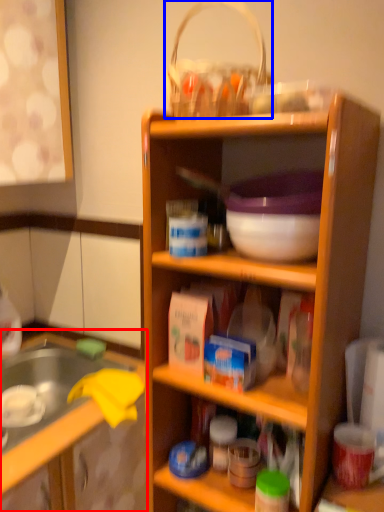
Question: Which of the following is the closest to the observer, cabinetry (highlighted by a red box) or basket (highlighted by a blue box)?

Choices:
 (A) cabinetry
 (B) basket

Answer: (B)